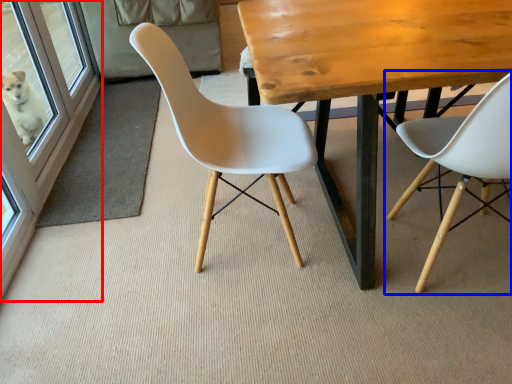
Question: Among these objects, which one is farthest to the camera, screen door (highlighted by a red box) or chair (highlighted by a blue box)?

Choices:
 (A) screen door
 (B) chair

Answer: (A)